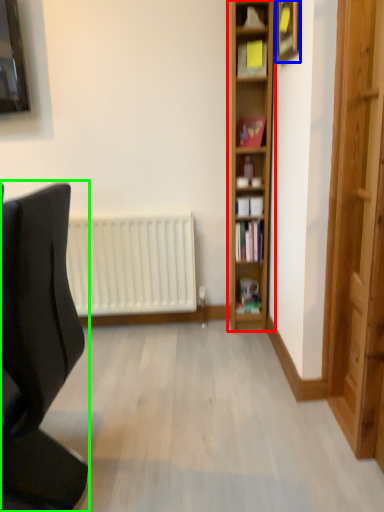
Question: Estimate the real-world distances between objects in this image. Which object is farther from shelf (highlighted by a red box), picture frame (highlighted by a blue box) or chair (highlighted by a green box)?

Choices:
 (A) picture frame
 (B) chair

Answer: (B)